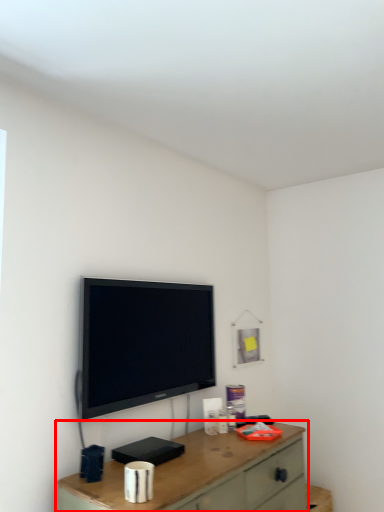
Question: From the image's perspective, what is the correct spatial relationship of desk (annotated by the red box) in relation to television?

Choices:
 (A) below
 (B) above

Answer: (A)